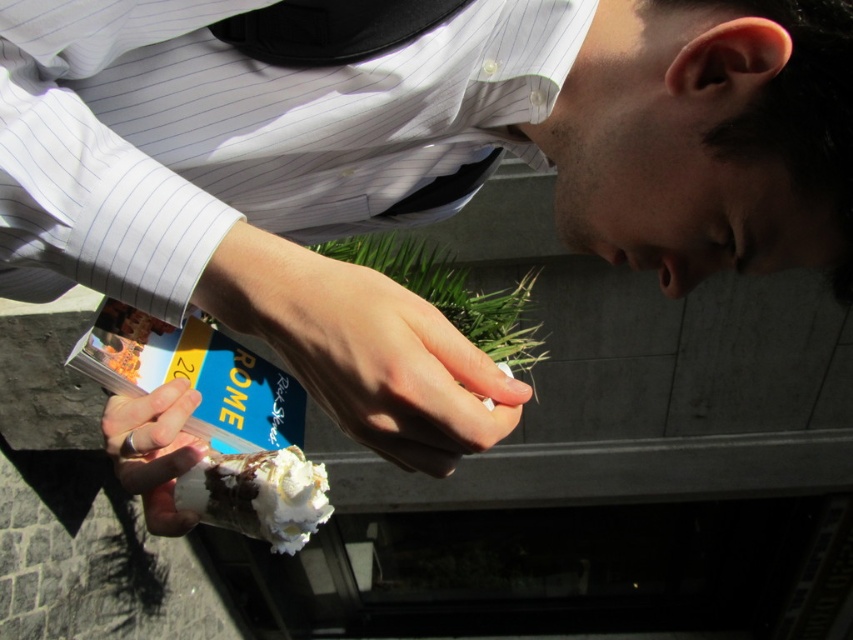
You are a photographer trying to capture the white striped dress shirt at center and the whipped cream cone at center in a single frame. Given that the shirt is larger than the cone, how should you position your camera to ensure both objects are clearly visible in the photo?

Since the white striped dress shirt at center is bigger than the whipped cream cone at center, position the camera closer to the whipped cream cone at center to balance their sizes in the frame.

You are a photographer trying to capture the whipped cream cone at center without the white striped dress shirt at center blocking it. Can you adjust your angle to do so?

The white striped dress shirt at center is in front of the whipped cream cone at center, so you would need to move your camera position to the side or behind the shirt to avoid blocking the cone.